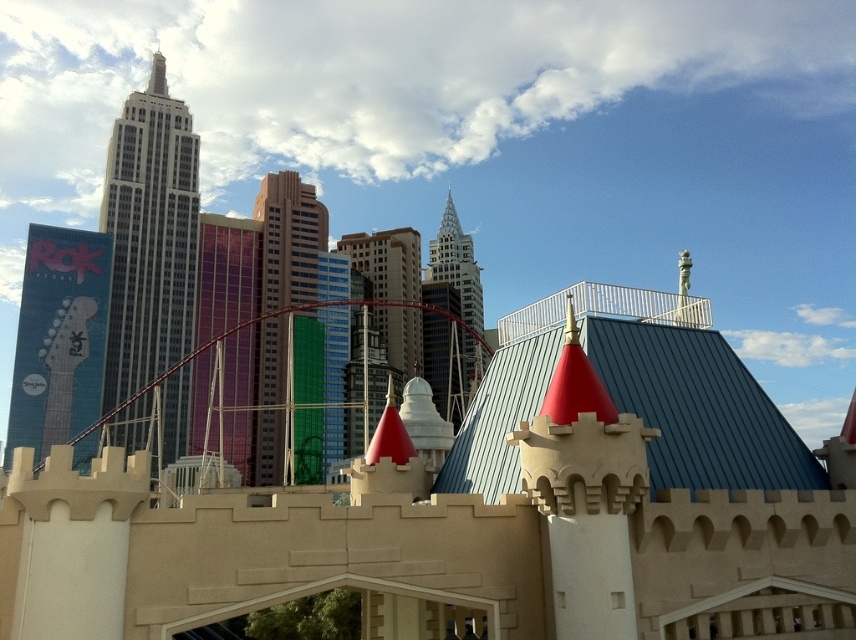
You are standing at the center of the urban landscape and want to locate the white glass skyscraper at upper left and the metallic guitar at left. Based on their positions, which object is closer to the right side of the image?

Answer: The white glass skyscraper at upper left is positioned to the right of the metallic guitar at left, so it is closer to the right side of the image.

You are an architect designing a new building. You observe the white glass skyscraper at upper left and the metallic guitar at left in the scene. Which of these two objects has a narrower width?

The white glass skyscraper at upper left is thinner than the metallic guitar at left, so the white glass skyscraper at upper left has a narrower width.

You are an architect designing a new building in this city. You want to ensure your new structure doesn not block the view of the white glass skyscraper at upper left from the metallic guitar at left. Based on the scene description, what should you consider about their relative heights?

The white glass skyscraper at upper left is taller than the metallic guitar at left. To avoid blocking its view, the new building should be shorter than the white glass skyscraper at upper left.